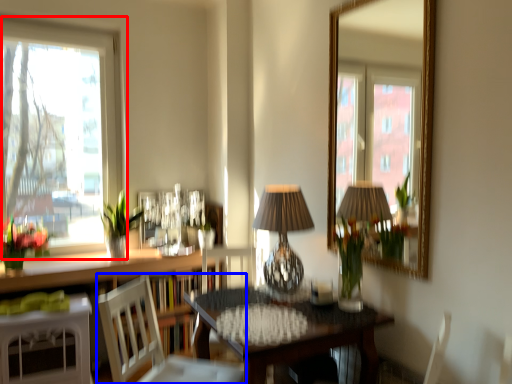
Question: Which object is further to the camera taking this photo, window (highlighted by a red box) or chair (highlighted by a blue box)?

Choices:
 (A) window
 (B) chair

Answer: (A)